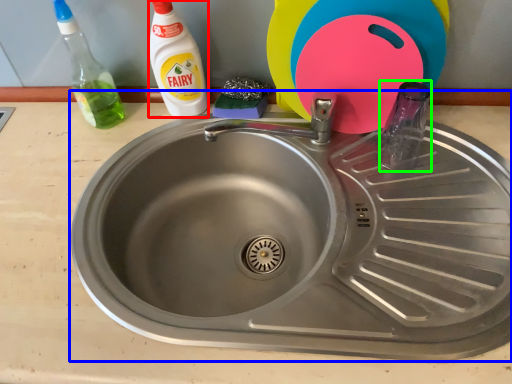
Question: Considering the real-world distances, which object is closest to cleaning product (highlighted by a red box)? sink (highlighted by a blue box) or bottle (highlighted by a green box).

Choices:
 (A) sink
 (B) bottle

Answer: (A)